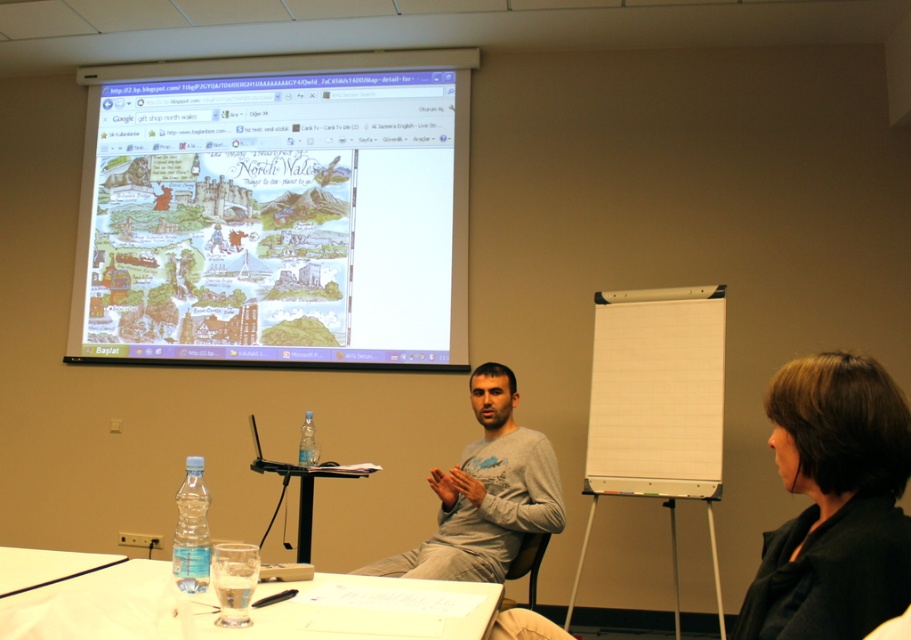
Who is positioned more to the right, black matte jacket at lower right or clear plastic table at lower left?

black matte jacket at lower right

The height and width of the screenshot is (640, 911). Describe the element at coordinates (834, 502) in the screenshot. I see `black matte jacket at lower right` at that location.

I want to click on black matte jacket at lower right, so click(x=834, y=502).

Who is more distant from viewer, (345, 602) or (277, 502)?

Positioned behind is point (277, 502).

Does clear plastic table at lower center appear on the right side of black plastic table at center?

Yes, clear plastic table at lower center is to the right of black plastic table at center.

Is point (272, 614) farther from viewer compared to point (302, 540)?

No, it is in front of (302, 540).

Locate an element on the screen. This screenshot has width=911, height=640. clear plastic table at lower center is located at coordinates (249, 608).

Who is lower down, black matte jacket at lower right or black plastic table at center?

Positioned lower is black plastic table at center.

The width and height of the screenshot is (911, 640). Describe the element at coordinates (834, 502) in the screenshot. I see `black matte jacket at lower right` at that location.

Locate an element on the screen. The width and height of the screenshot is (911, 640). black matte jacket at lower right is located at coordinates (834, 502).